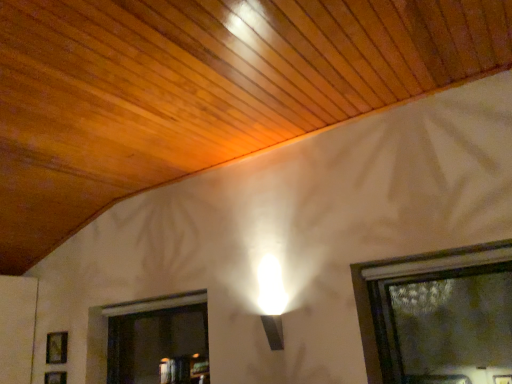
Question: Is wooden picture frame at lower left, which is the 1th picture frame in bottom-to-top order, bigger or smaller than wooden frame at lower left, which is the 2th picture frame from bottom to top?

Choices:
 (A) big
 (B) small

Answer: (B)

Question: In terms of width, does wooden picture frame at lower left, acting as the 2th picture frame starting from the top, look wider or thinner when compared to wooden frame at lower left, placed as the first picture frame when sorted from top to bottom?

Choices:
 (A) wide
 (B) thin

Answer: (B)

Question: Is wooden picture frame at lower left, acting as the 2th picture frame starting from the top, spatially inside wooden frame at lower left, placed as the first picture frame when sorted from top to bottom, or outside of it?

Choices:
 (A) inside
 (B) outside

Answer: (B)

Question: In the image, is wooden frame at lower left, placed as the first picture frame when sorted from top to bottom, on the left side or the right side of wooden picture frame at lower left, which is the 1th picture frame in bottom-to-top order?

Choices:
 (A) left
 (B) right

Answer: (A)

Question: Looking at the image, does wooden frame at lower left, which is the 2th picture frame from bottom to top, seem bigger or smaller compared to wooden picture frame at lower left, acting as the 2th picture frame starting from the top?

Choices:
 (A) big
 (B) small

Answer: (A)

Question: From a real-world perspective, is wooden frame at lower left, which is the 2th picture frame from bottom to top, physically located above or below wooden picture frame at lower left, acting as the 2th picture frame starting from the top?

Choices:
 (A) below
 (B) above

Answer: (B)

Question: Which is correct: wooden frame at lower left, placed as the first picture frame when sorted from top to bottom, is inside wooden picture frame at lower left, which is the 1th picture frame in bottom-to-top order, or outside of it?

Choices:
 (A) inside
 (B) outside

Answer: (B)